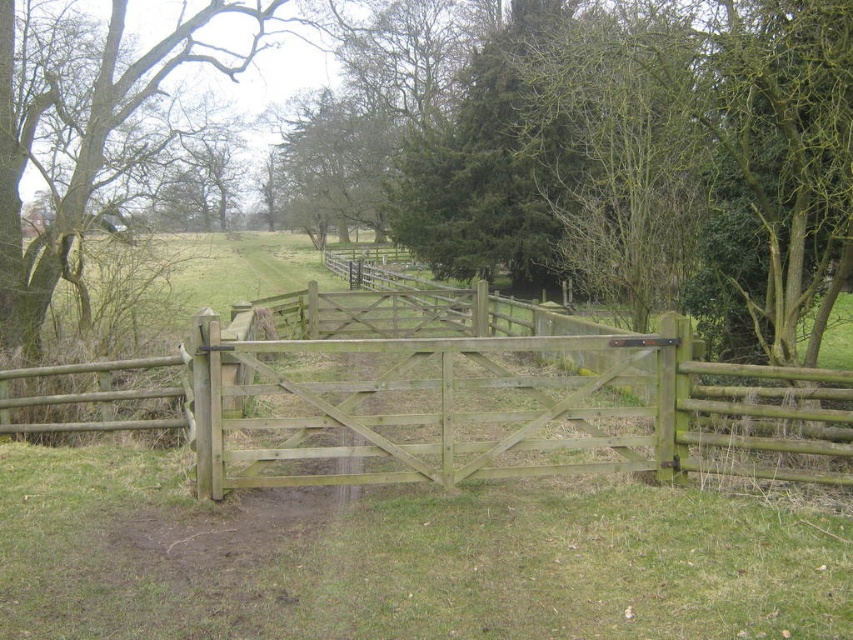
Can you confirm if light brown wooden gate at center is positioned to the right of green wood tree at center?

Indeed, light brown wooden gate at center is positioned on the right side of green wood tree at center.

Can you confirm if light brown wooden gate at center is shorter than green wood tree at center?

Indeed, light brown wooden gate at center has a lesser height compared to green wood tree at center.

Is point (489, 369) positioned before point (32, 330)?

Yes, point (489, 369) is in front of point (32, 330).

Locate an element on the screen. This screenshot has width=853, height=640. light brown wooden gate at center is located at coordinates (451, 397).